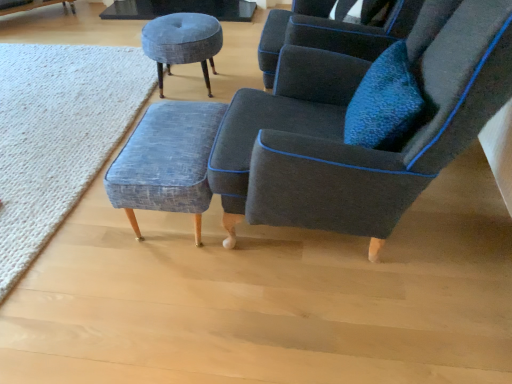
You are a GUI agent. You are given a task and a screenshot of the screen. Output one action in this format:
    pyautogui.click(x=<x>, y=<y>)
    Task: Click on the free location in front of dark gray fabric chair at center
    The width and height of the screenshot is (512, 384).
    Given the screenshot: What is the action you would take?
    pyautogui.click(x=347, y=333)